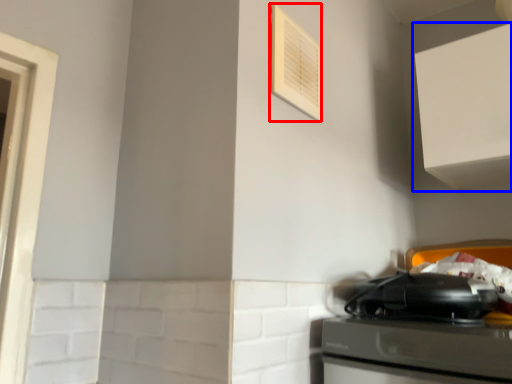
Question: Which object is further to the camera taking this photo, air conditioner (highlighted by a red box) or cabinetry (highlighted by a blue box)?

Choices:
 (A) air conditioner
 (B) cabinetry

Answer: (B)